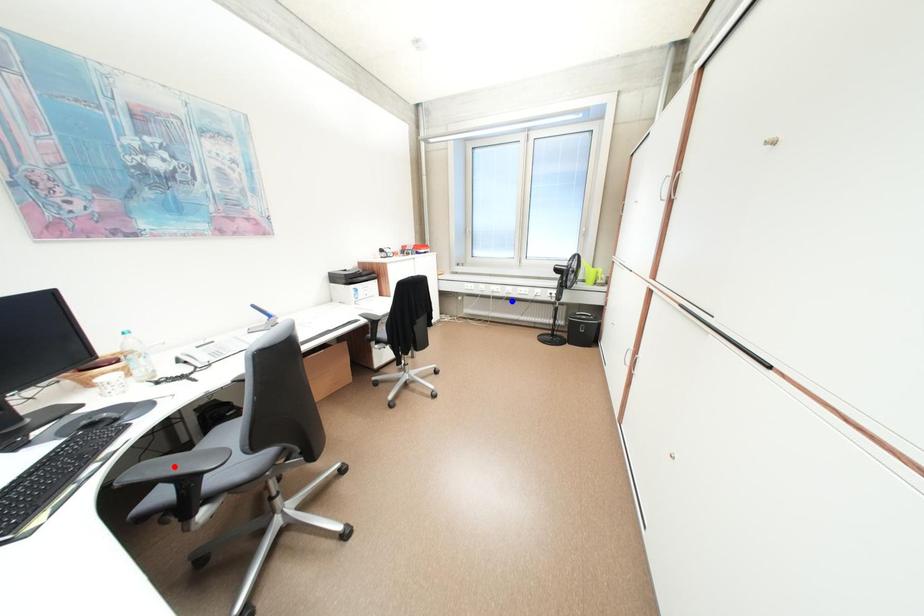
Question: Two points are marked on the image. Which point is closer to the camera?

Choices:
 (A) Blue point is closer.
 (B) Red point is closer.

Answer: (B)